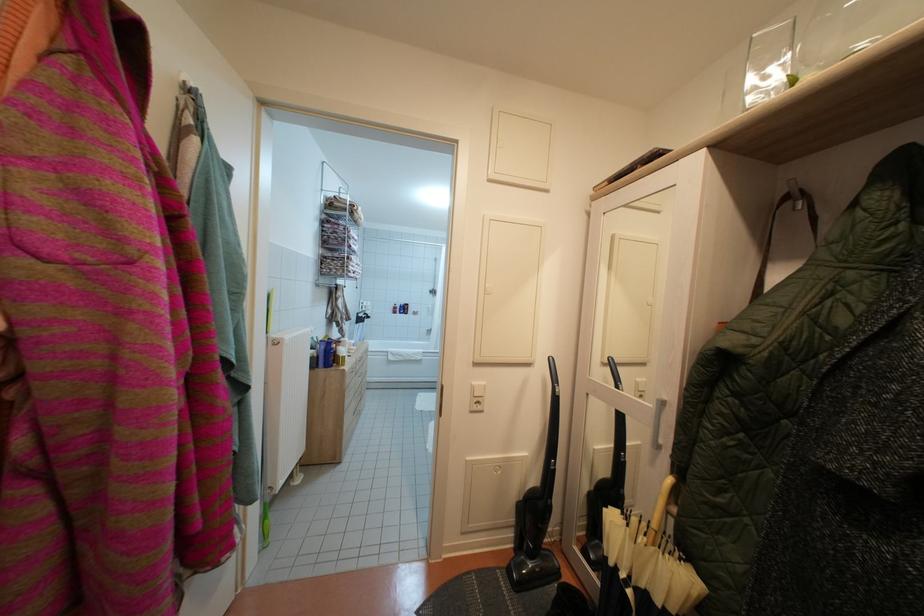
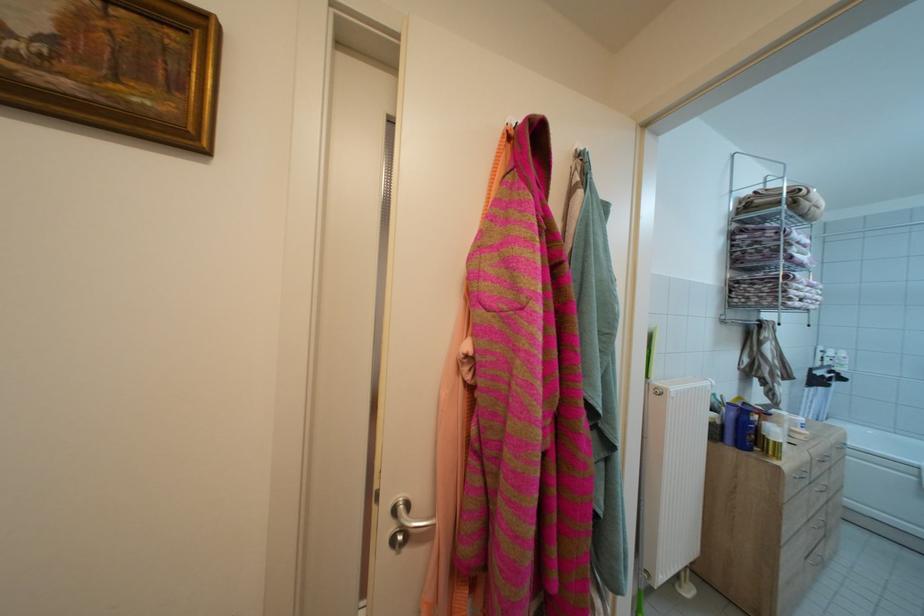
The point at (x=282, y=341) is marked in the first image. Where is the corresponding point in the second image?

(663, 389)